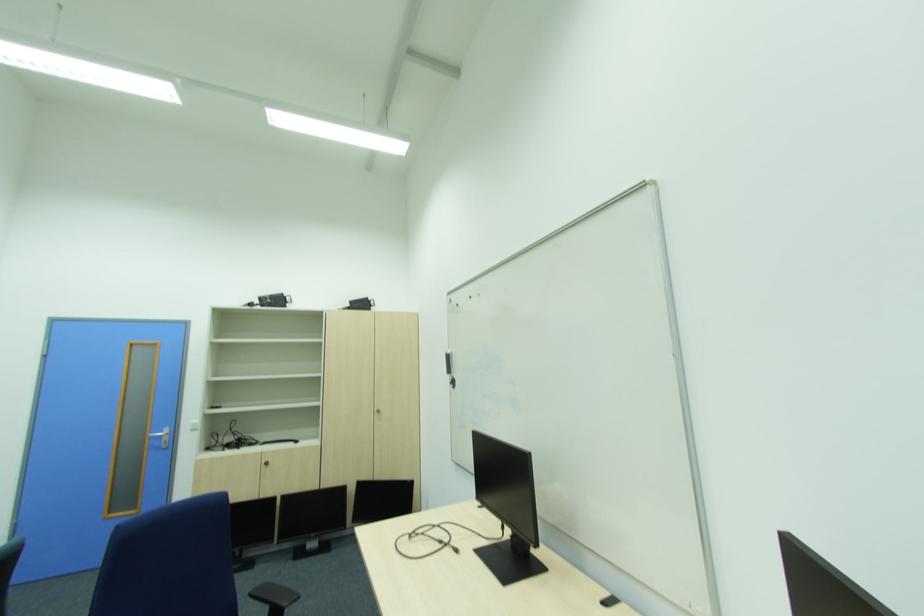
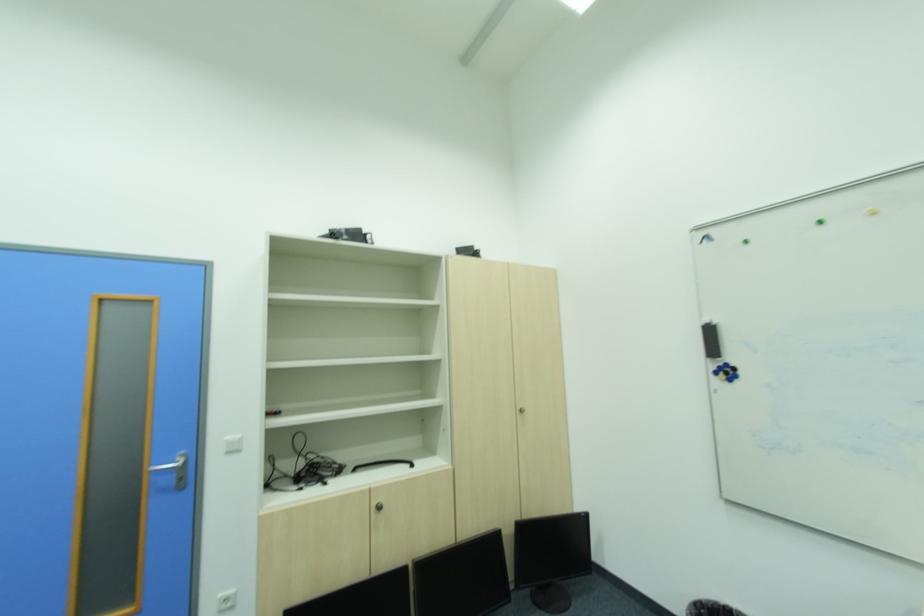
What movement of the cameraman would produce the second image?

The cameraman walked toward left, forward.